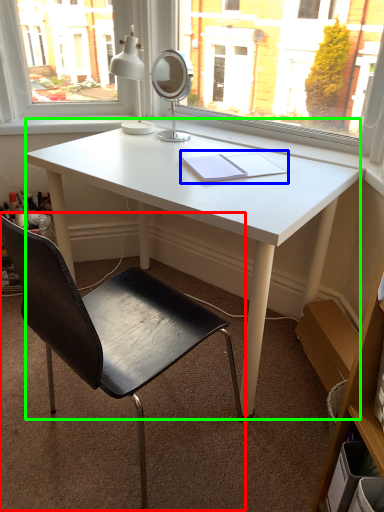
Question: Estimate the real-world distances between objects in this image. Which object is closer to chair (highlighted by a red box), notebook (highlighted by a blue box) or desk (highlighted by a green box)?

Choices:
 (A) notebook
 (B) desk

Answer: (B)